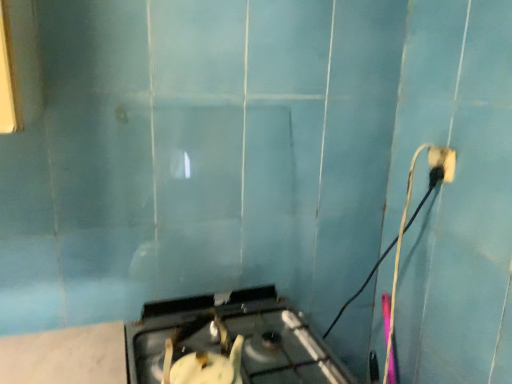
Question: Is black plastic power plug at upper right shorter than metallic silver gas stove at center?

Choices:
 (A) no
 (B) yes

Answer: (B)

Question: Does black plastic power plug at upper right have a greater height compared to metallic silver gas stove at center?

Choices:
 (A) no
 (B) yes

Answer: (A)

Question: Does black plastic power plug at upper right have a smaller size compared to metallic silver gas stove at center?

Choices:
 (A) no
 (B) yes

Answer: (B)

Question: Is the depth of black plastic power plug at upper right greater than that of metallic silver gas stove at center?

Choices:
 (A) no
 (B) yes

Answer: (B)

Question: Could metallic silver gas stove at center be considered to be inside black plastic power plug at upper right?

Choices:
 (A) no
 (B) yes

Answer: (A)

Question: Is black plastic power plug at upper right positioned beyond the bounds of metallic silver gas stove at center?

Choices:
 (A) no
 (B) yes

Answer: (B)

Question: From a real-world perspective, is metallic silver gas stove at center positioned under black plastic power plug at upper right based on gravity?

Choices:
 (A) yes
 (B) no

Answer: (A)

Question: Considering the relative sizes of metallic silver gas stove at center and black plastic power plug at upper right in the image provided, is metallic silver gas stove at center taller than black plastic power plug at upper right?

Choices:
 (A) yes
 (B) no

Answer: (A)

Question: Would you say metallic silver gas stove at center is a long distance from black plastic power plug at upper right?

Choices:
 (A) no
 (B) yes

Answer: (A)

Question: From the image's perspective, is metallic silver gas stove at center located beneath black plastic power plug at upper right?

Choices:
 (A) yes
 (B) no

Answer: (A)

Question: Are metallic silver gas stove at center and black plastic power plug at upper right beside each other?

Choices:
 (A) no
 (B) yes

Answer: (A)

Question: Considering the relative positions of metallic silver gas stove at center and black plastic power plug at upper right in the image provided, is metallic silver gas stove at center to the left of black plastic power plug at upper right from the viewer's perspective?

Choices:
 (A) no
 (B) yes

Answer: (B)

Question: Considering the positions of metallic silver gas stove at center and black plastic power plug at upper right in the image, is metallic silver gas stove at center wider or thinner than black plastic power plug at upper right?

Choices:
 (A) wide
 (B) thin

Answer: (A)